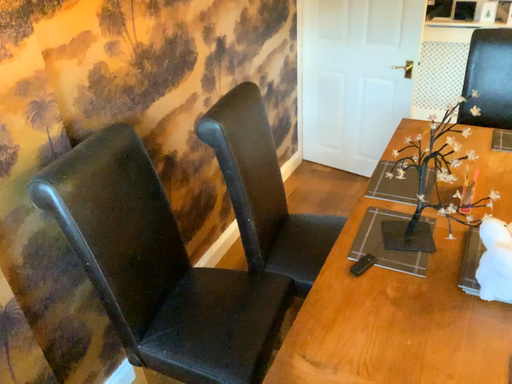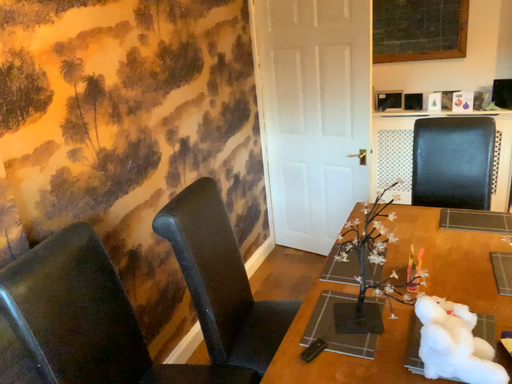
Question: How did the camera likely rotate when shooting the video?

Choices:
 (A) rotated downward
 (B) rotated upward

Answer: (B)